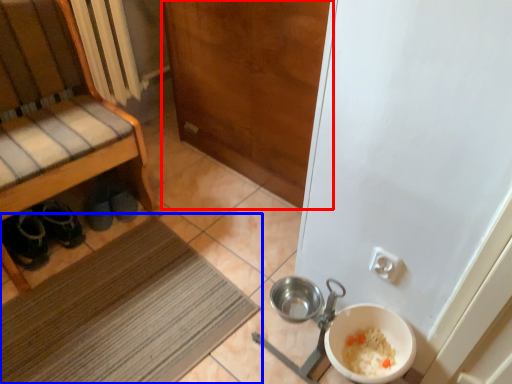
Question: Which of the following is the closest to the observer, door (highlighted by a red box) or mat (highlighted by a blue box)?

Choices:
 (A) door
 (B) mat

Answer: (B)